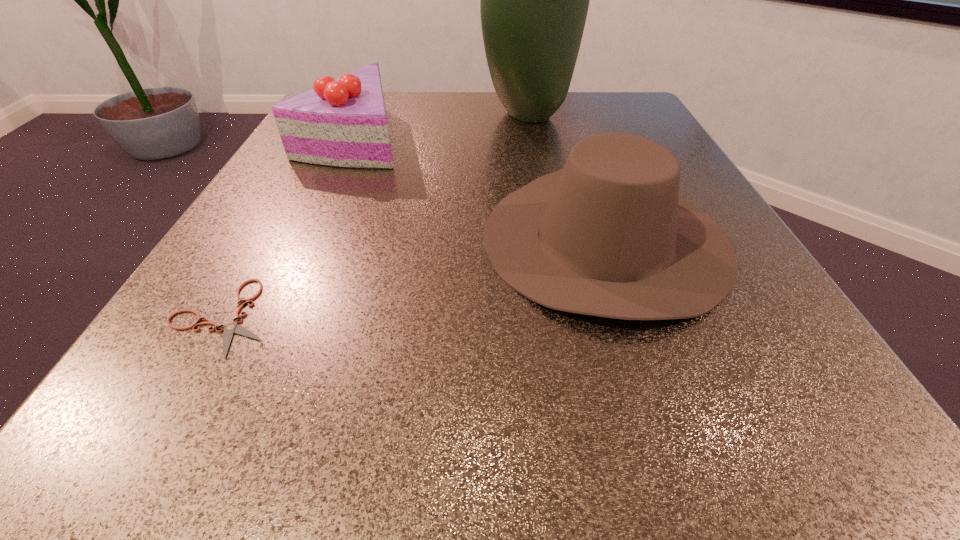
This screenshot has height=540, width=960. Identify the location of the tallest object. (534, 0).

Image resolution: width=960 pixels, height=540 pixels. I want to click on cake, so click(342, 122).

Where is `cowboy hat`? The width and height of the screenshot is (960, 540). cowboy hat is located at coordinates (607, 235).

Where is `the shortest object`? The width and height of the screenshot is (960, 540). the shortest object is located at coordinates (229, 329).

Identify the location of vacant region located on the left of the tallest object. The width and height of the screenshot is (960, 540). (405, 115).

The height and width of the screenshot is (540, 960). Find the location of `vacant space located 0.050m on the back of the cake`. vacant space located 0.050m on the back of the cake is located at coordinates (370, 101).

This screenshot has height=540, width=960. What are the coordinates of `vacant region located on the back of the cowboy hat` in the screenshot? It's located at (573, 143).

Where is `vacant region located on the right of the shears`? vacant region located on the right of the shears is located at coordinates (466, 317).

Find the location of a particular element. This screenshot has width=960, height=540. vase that is at the far edge is located at coordinates (534, 0).

What are the coordinates of `cake that is positioned at the far edge` in the screenshot? It's located at (342, 122).